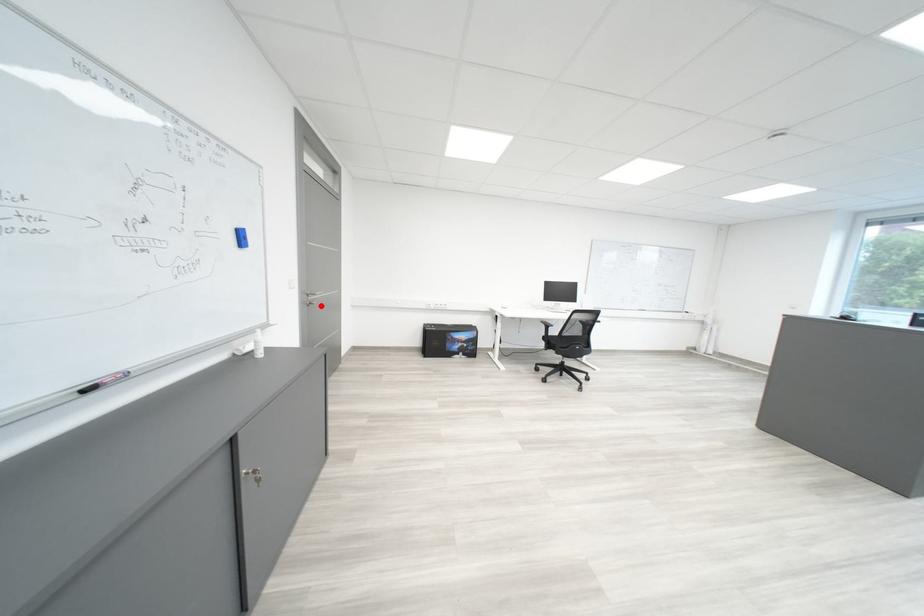
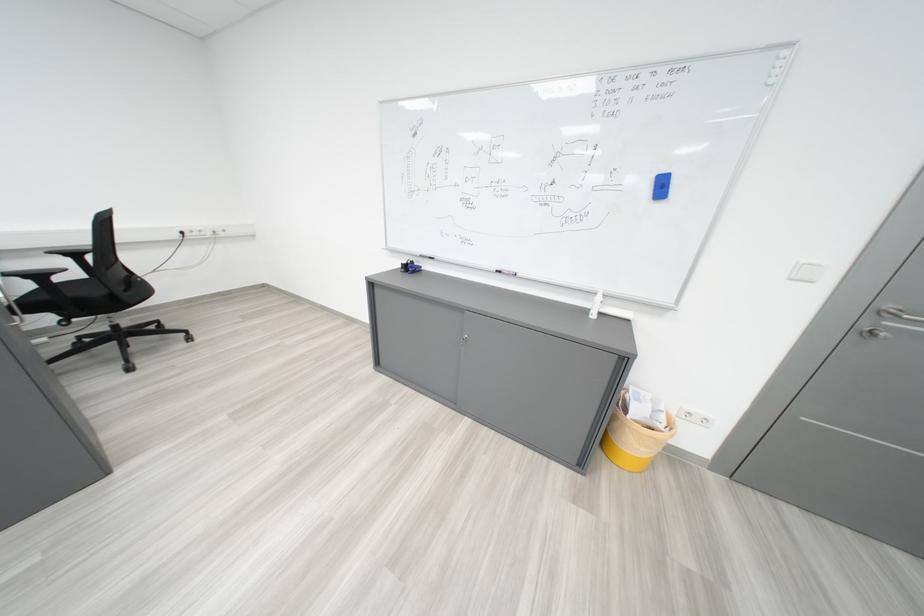
Where in the second image is the point corresponding to the highlighted location from the first image?

(870, 333)